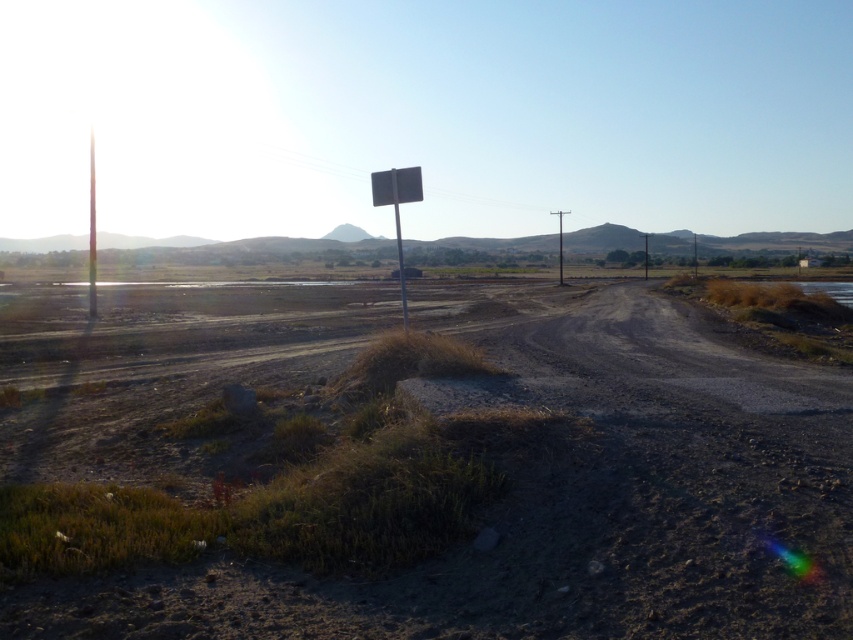
Question: Estimate the real-world distances between objects in this image. Which object is farther from the metallic sign at center?

Choices:
 (A) dull brown dirt at center
 (B) metallic signpost at left

Answer: (B)

Question: Estimate the real-world distances between objects in this image. Which object is closer to the metallic sign at center?

Choices:
 (A) smooth concrete pole at center
 (B) metallic signpost at center

Answer: (B)

Question: Does metallic gray sign at center appear under metallic signpost at center?

Choices:
 (A) yes
 (B) no

Answer: (B)

Question: Is metallic sign at center bigger than smooth concrete pole at center?

Choices:
 (A) yes
 (B) no

Answer: (B)

Question: Which point is farther to the camera?

Choices:
 (A) (387, 188)
 (B) (91, 205)
 (C) (398, 266)

Answer: (B)

Question: Can you confirm if metallic signpost at center is positioned to the left of smooth concrete pole at center?

Choices:
 (A) no
 (B) yes

Answer: (B)